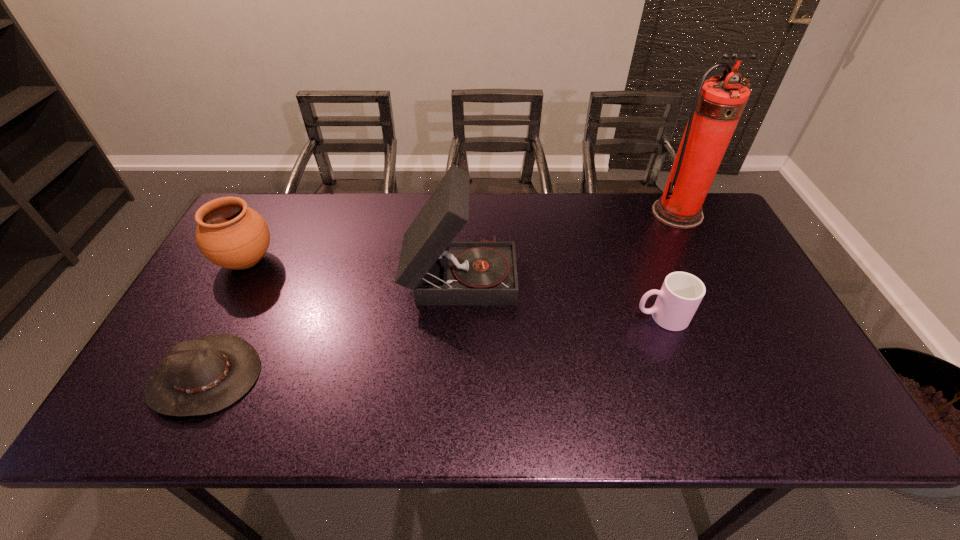
Find the location of a particular element. This screenshot has height=540, width=960. fire extinguisher is located at coordinates (719, 102).

Where is `the tallest object`? The image size is (960, 540). the tallest object is located at coordinates (719, 102).

Where is `the third object from left to right`? The height and width of the screenshot is (540, 960). the third object from left to right is located at coordinates (440, 272).

I want to click on phonograph_record, so click(440, 272).

The height and width of the screenshot is (540, 960). Find the location of `the third shortest object`. the third shortest object is located at coordinates (229, 234).

Locate an element on the screen. the second object from right to left is located at coordinates (681, 293).

Locate an element on the screen. The image size is (960, 540). the fourth tallest object is located at coordinates (681, 293).

Identify the location of the shortest object. The height and width of the screenshot is (540, 960). (203, 376).

This screenshot has width=960, height=540. I want to click on the nearest object, so click(203, 376).

Locate an element on the screen. The width and height of the screenshot is (960, 540). vacant position located at the discharge end of the fire extinguisher is located at coordinates (697, 253).